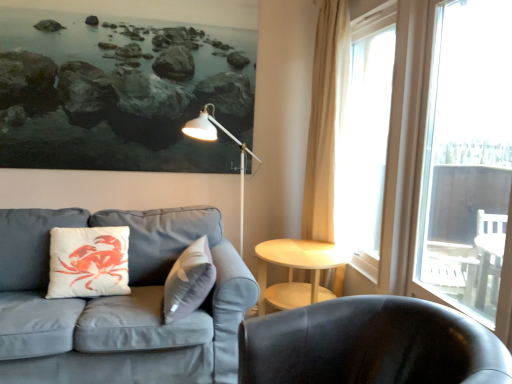
Question: Is shiny black chair at lower right to the left of light wood/woodenobject at center from the viewer's perspective?

Choices:
 (A) no
 (B) yes

Answer: (A)

Question: From a real-world perspective, is shiny black chair at lower right below light wood/woodenobject at center?

Choices:
 (A) yes
 (B) no

Answer: (B)

Question: Can you confirm if shiny black chair at lower right is positioned to the right of light wood/woodenobject at center?

Choices:
 (A) yes
 (B) no

Answer: (A)

Question: Is shiny black chair at lower right facing away from light wood/woodenobject at center?

Choices:
 (A) yes
 (B) no

Answer: (B)

Question: Is shiny black chair at lower right bigger than light wood/woodenobject at center?

Choices:
 (A) yes
 (B) no

Answer: (A)

Question: Does shiny black chair at lower right turn towards light wood/woodenobject at center?

Choices:
 (A) yes
 (B) no

Answer: (B)

Question: Is translucent glass window at right, which is the 2th window from front to back, outside of white matte pillow at left?

Choices:
 (A) no
 (B) yes

Answer: (B)

Question: Is translucent glass window at right, which is the 2th window from front to back, closer to camera compared to white matte pillow at left?

Choices:
 (A) no
 (B) yes

Answer: (A)

Question: Considering the relative positions of translucent glass window at right, which is the 2th window from front to back, and white matte pillow at left in the image provided, is translucent glass window at right, which is the 2th window from front to back, behind white matte pillow at left?

Choices:
 (A) no
 (B) yes

Answer: (B)

Question: Considering the relative positions of translucent glass window at right, which is the 2th window from front to back, and white matte pillow at left in the image provided, is translucent glass window at right, which is the 2th window from front to back, to the right of white matte pillow at left from the viewer's perspective?

Choices:
 (A) no
 (B) yes

Answer: (B)

Question: Is translucent glass window at right, which is the 2th window from front to back, turned away from white matte pillow at left?

Choices:
 (A) no
 (B) yes

Answer: (A)

Question: Considering the relative sizes of transparent glass window at right, the first window positioned from the front, and translucent glass window at right, positioned as the first window in back-to-front order, in the image provided, is transparent glass window at right, the first window positioned from the front, thinner than translucent glass window at right, positioned as the first window in back-to-front order,?

Choices:
 (A) yes
 (B) no

Answer: (A)